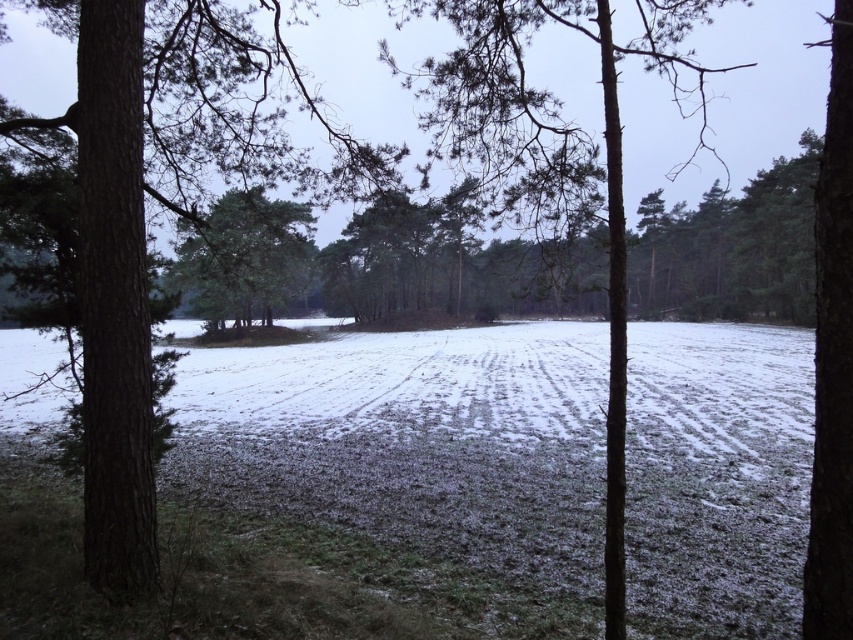
You are an observer standing in front of the two trees in the winter landscape. Which tree, the brown rough bark tree at left or the smooth bark tree at center, is shorter in height?

The brown rough bark tree at left is smaller than the smooth bark tree at center, so the brown rough bark tree at left is shorter in height.

You are standing at the center of the winter landscape and want to reach the smooth bark tree at center. According to the coordinates provided, in which direction should you move from your current position?

The smooth bark tree at center is located at point (550,160), so you should move towards the lower left direction from your current position at the center.

You are an arborist assessing the trees in the winter landscape. You need to determine which tree has a thicker trunk between the brown rough bark tree at left and the green matte tree at center. Which one should you examine first?

The green matte tree at center has a greater width, so you should examine the green matte tree at center first because it likely has the thicker trunk.